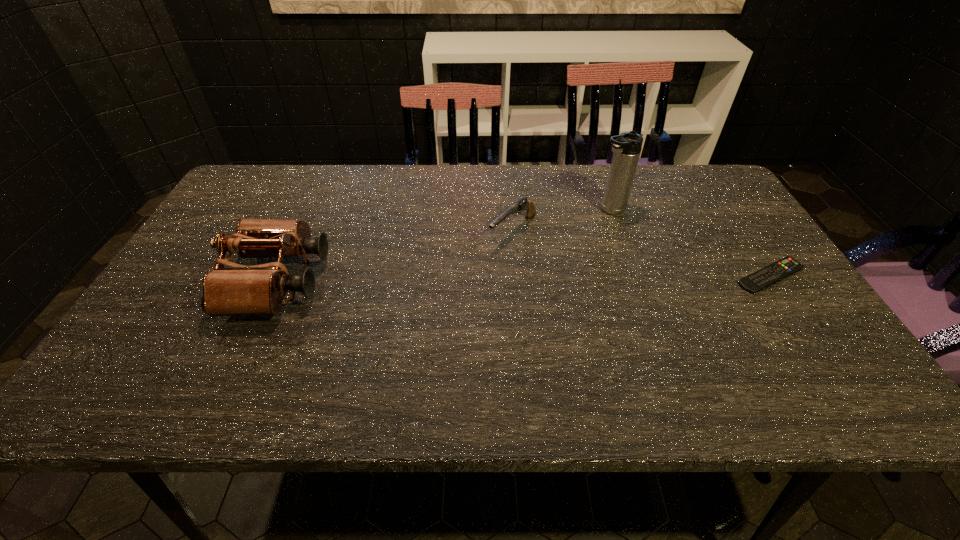
Where is `vacant point at the near edge`? The width and height of the screenshot is (960, 540). vacant point at the near edge is located at coordinates (564, 344).

Locate an element on the screen. vacant region at the right edge of the desktop is located at coordinates 770,330.

At what (x,y) coordinates should I click in order to perform the action: click on free location at the far left corner. Please return your answer as a coordinate pair (x, y). Looking at the image, I should click on (226, 201).

Where is `blank area at the near left corner`? blank area at the near left corner is located at coordinates (144, 347).

This screenshot has height=540, width=960. Identify the location of free space at the far right corner. (689, 164).

Find the location of `free spot between the second object from left to right and the second tallest object`. free spot between the second object from left to right and the second tallest object is located at coordinates (396, 256).

The width and height of the screenshot is (960, 540). What are the coordinates of `empty location between the third shortest object and the thermos bottle` in the screenshot? It's located at (444, 246).

What are the coordinates of `vacant area between the second tallest object and the rightmost object` in the screenshot? It's located at (524, 279).

Locate an element on the screen. This screenshot has height=540, width=960. vacant point located between the gun and the rightmost object is located at coordinates (641, 254).

Where is `vacant space that's between the leftmost object and the thermos bottle`? This screenshot has height=540, width=960. vacant space that's between the leftmost object and the thermos bottle is located at coordinates (444, 246).